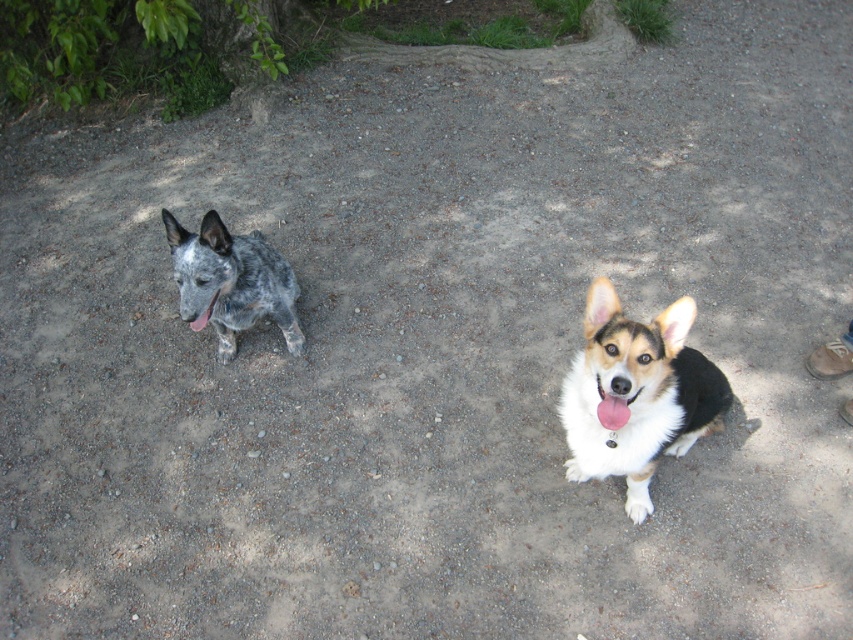
This screenshot has height=640, width=853. What do you see at coordinates (636, 394) in the screenshot? I see `tri-color fur dog at center` at bounding box center [636, 394].

Can you confirm if tri-color fur dog at center is taller than speckled fur dog at left?

Yes.

Is point (666, 404) farther from viewer compared to point (206, 236)?

No, it is not.

Image resolution: width=853 pixels, height=640 pixels. Find the location of `tri-color fur dog at center`. tri-color fur dog at center is located at coordinates (636, 394).

Between speckled fur dog at left and pink glossy tongue at left, which one is positioned higher?

speckled fur dog at left is higher up.

You are a GUI agent. You are given a task and a screenshot of the screen. Output one action in this format:
    pyautogui.click(x=<x>, y=<y>)
    Task: Click on the speckled fur dog at left
    The height and width of the screenshot is (640, 853).
    Given the screenshot: What is the action you would take?
    [x=231, y=282]

Can you confirm if tri-color fur dog at center is taller than pink glossy tongue at left?

Yes, tri-color fur dog at center is taller than pink glossy tongue at left.

Looking at this image, is tri-color fur dog at center thinner than pink glossy tongue at left?

No, tri-color fur dog at center is not thinner than pink glossy tongue at left.

Is point (618, 406) less distant than point (210, 305)?

Yes.

Identify the location of tri-color fur dog at center. The height and width of the screenshot is (640, 853). (636, 394).